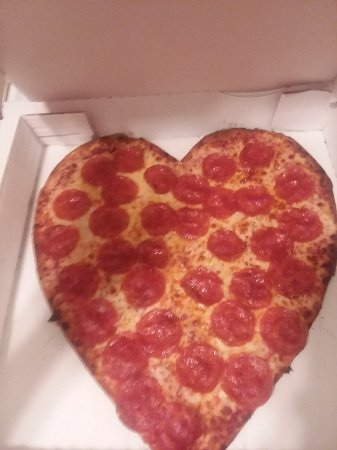
Where is `box`? The image size is (337, 450). box is located at coordinates (66, 404).